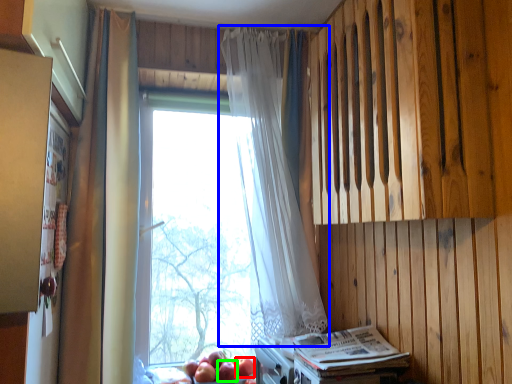
Question: Which object is the farthest from apple (highlighted by a red box)? Choose among these: curtain (highlighted by a blue box) or apple (highlighted by a green box).

Choices:
 (A) curtain
 (B) apple

Answer: (A)